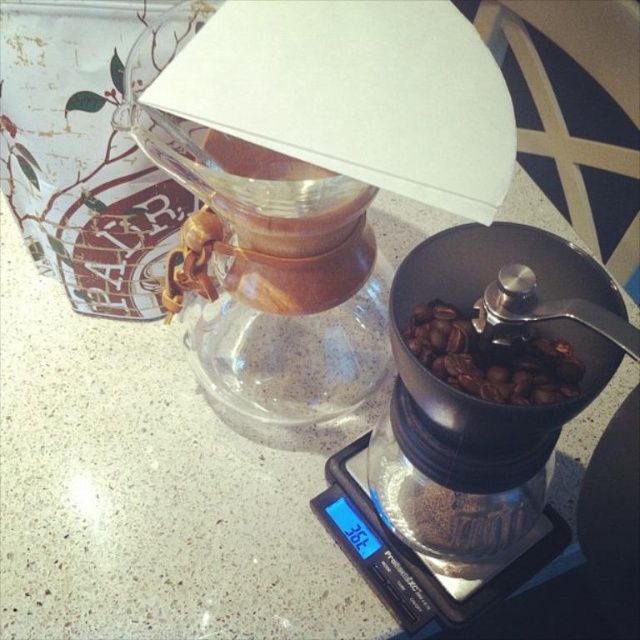
Is transparent glass carafe at upper center above black matte coffee grinder at center?

Indeed, transparent glass carafe at upper center is positioned over black matte coffee grinder at center.

Is point (304, 84) more distant than point (493, 522)?

No, it is not.

This screenshot has width=640, height=640. I want to click on transparent glass carafe at upper center, so click(x=312, y=173).